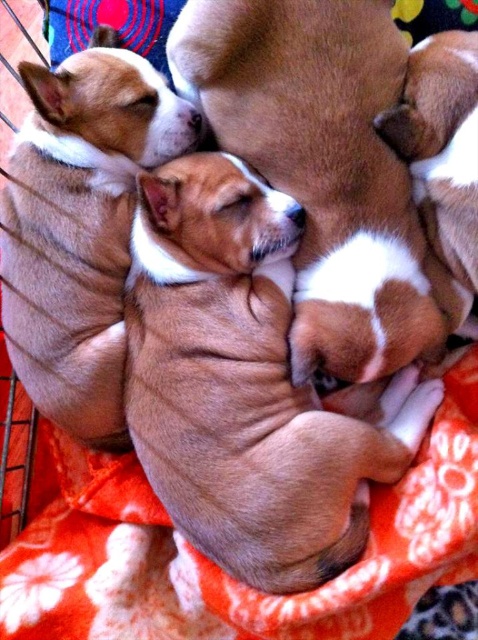
Question: Can you confirm if orange floral blanket at center is smaller than smooth brown puppy at center?

Choices:
 (A) no
 (B) yes

Answer: (A)

Question: Estimate the real-world distances between objects in this image. Which object is closer to the smooth brown puppy at center?

Choices:
 (A) brown smooth fur at center
 (B) orange floral blanket at center
 (C) brown furry dog at center

Answer: (A)

Question: Does brown smooth fur at center appear under brown furry dog at center?

Choices:
 (A) no
 (B) yes

Answer: (B)

Question: Where is brown smooth fur at center located in relation to brown soft fur at upper right in the image?

Choices:
 (A) above
 (B) below

Answer: (B)

Question: Among these objects, which one is nearest to the camera?

Choices:
 (A) brown soft fur at upper right
 (B) brown furry dog at center
 (C) brown smooth fur at center

Answer: (B)

Question: Estimate the real-world distances between objects in this image. Which object is farther from the brown smooth fur at center?

Choices:
 (A) brown furry dog at center
 (B) orange floral blanket at center
 (C) smooth brown puppy at center
 (D) brown soft fur at upper right

Answer: (D)